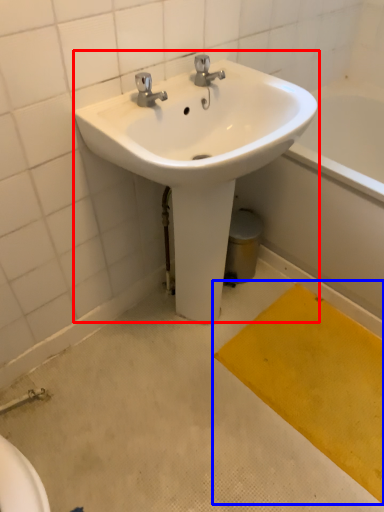
Question: Among these objects, which one is farthest to the camera, sink (highlighted by a red box) or doormat (highlighted by a blue box)?

Choices:
 (A) sink
 (B) doormat

Answer: (B)